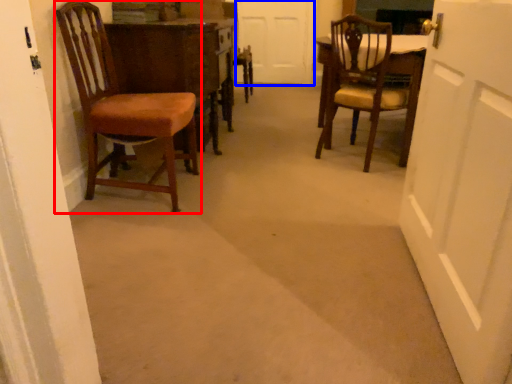
Question: Which object appears farthest to the camera in this image, chair (highlighted by a red box) or door (highlighted by a blue box)?

Choices:
 (A) chair
 (B) door

Answer: (B)